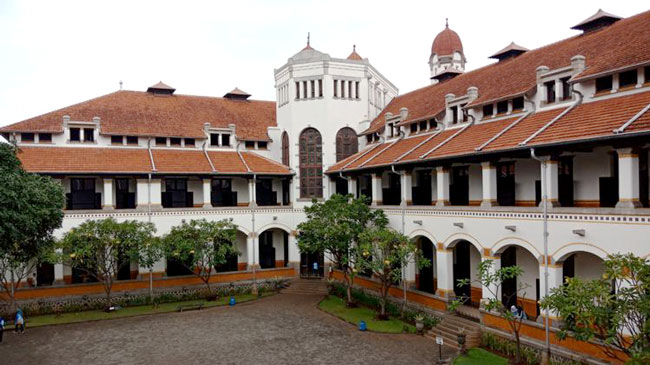
Where is `bench`? bench is located at coordinates (194, 308).